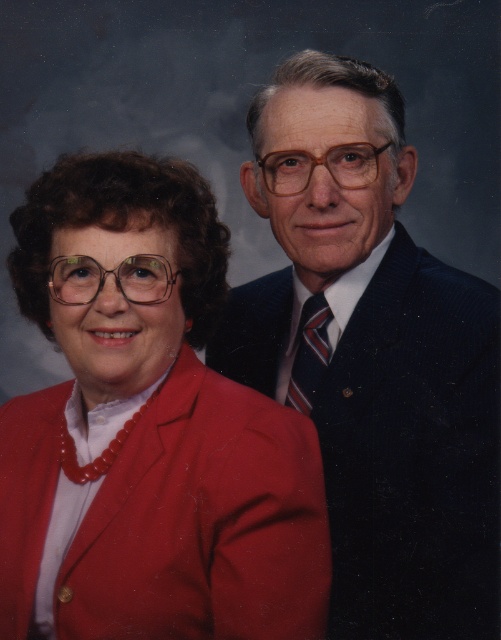
Which of these two, dark blue suit at center or striped fabric tie at center-right, stands taller?

dark blue suit at center is taller.

Does point (316, 76) come behind point (304, 403)?

No.

Between point (393, 593) and point (322, 298), which one is positioned behind?

The point (322, 298) is more distant.

Where is `dark blue suit at center`? dark blue suit at center is located at coordinates (375, 356).

Is matte red blazer at left to the left of dark blue suit at center from the viewer's perspective?

Indeed, matte red blazer at left is positioned on the left side of dark blue suit at center.

Between matte red blazer at left and dark blue suit at center, which one is positioned lower?

matte red blazer at left is below.

Identify the location of matte red blazer at left. This screenshot has height=640, width=501. (147, 429).

Is matte red blazer at left above striped fabric tie at center-right?

Actually, matte red blazer at left is below striped fabric tie at center-right.

Does matte red blazer at left appear on the right side of striped fabric tie at center-right?

No, matte red blazer at left is not to the right of striped fabric tie at center-right.

Locate an element on the screen. This screenshot has width=501, height=640. matte red blazer at left is located at coordinates (147, 429).